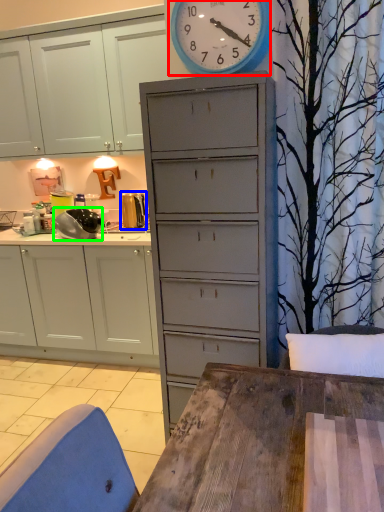
Question: Which object is positioned farthest from wall clock (highlighted by a red box)? Select from appliance (highlighted by a blue box) and appliance (highlighted by a green box).

Choices:
 (A) appliance
 (B) appliance

Answer: (A)